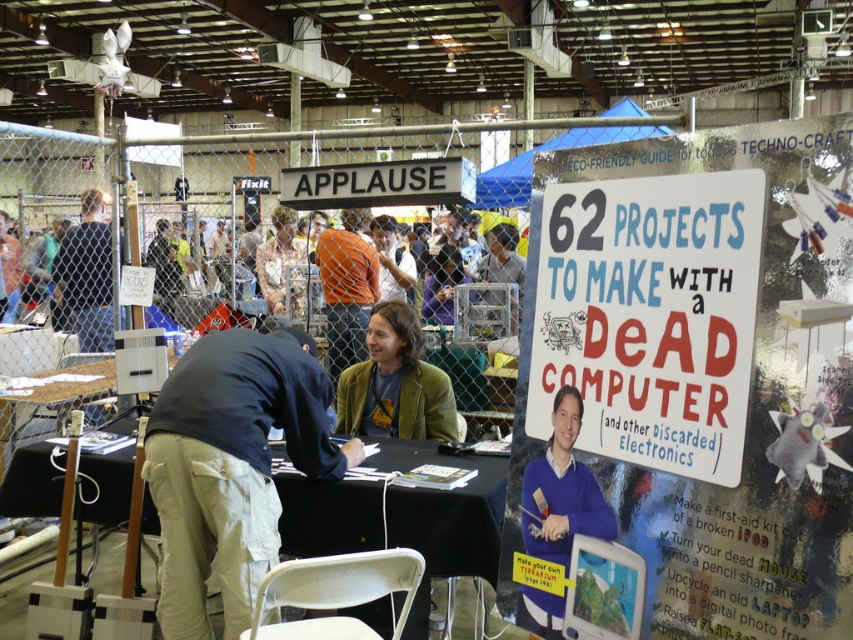
You are organizing a photo shoot in the described scene and need to place a wide backdrop behind the two individuals. Since the backdrop must cover both the blue sweater at center and the purple fabric shirt at center completely, which of the two items requires the backdrop to be wider to accommodate its size?

The purple fabric shirt at center requires the backdrop to be wider because it has a greater width than the blue sweater at center.

Based on the photo, you are at the convention and want to read the white paper sign at center. However, there are two people at the table in front of you. Can you see the sign clearly from your current position?

The white paper sign at center is located at point (x=650, y=316), which means it is positioned centrally in the image. Since the two people are at the table in the foreground, they might be blocking your view. However, the sign is centrally placed, so if you move slightly to the side or step back, you should be able to see it clearly.

You are organizing a photo shoot in the described scene and need to place a small camera on the table between the blue sweater at center and the purple fabric shirt at center. Which object should the camera be closer to if the camera has to be placed closer to the smaller item?

The camera should be placed closer to the blue sweater at center because it is smaller than the purple fabric shirt at center.